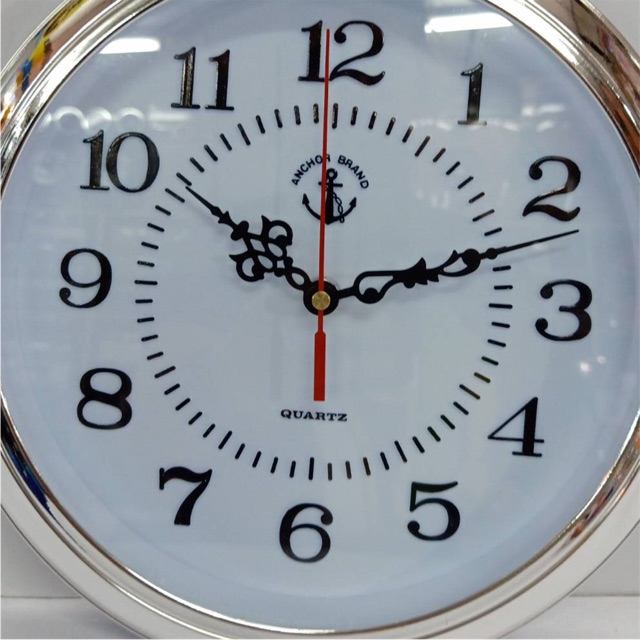
You are a GUI agent. You are given a task and a screenshot of the screen. Output one action in this format:
    pyautogui.click(x=<x>, y=<y>)
    Task: Click on the reflection of flourescent light fixtures in the face glass
    The width and height of the screenshot is (640, 640).
    Given the screenshot: What is the action you would take?
    pyautogui.click(x=125, y=45), pyautogui.click(x=472, y=22)